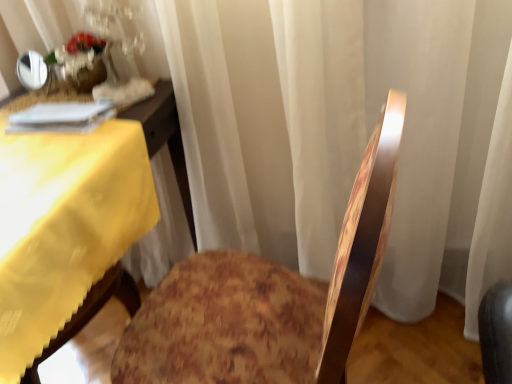
The width and height of the screenshot is (512, 384). Describe the element at coordinates (77, 63) in the screenshot. I see `translucent glass vase at upper left` at that location.

The image size is (512, 384). What do you see at coordinates (165, 137) in the screenshot? I see `yellow fabric table at left` at bounding box center [165, 137].

This screenshot has height=384, width=512. I want to click on yellow fabric table at left, so click(165, 137).

Image resolution: width=512 pixels, height=384 pixels. I want to click on translucent glass vase at upper left, so click(77, 63).

From a real-world perspective, between translucent glass vase at upper left and wooden floral-patterned chair at center, who is vertically higher?

translucent glass vase at upper left.

Between point (64, 78) and point (327, 308), which one is positioned in front?

Point (327, 308)

Looking at this image, from the image's perspective, between translucent glass vase at upper left and wooden floral-patterned chair at center, which one is located above?

From the image's view, translucent glass vase at upper left is above.

Which of these two, translucent glass vase at upper left or wooden floral-patterned chair at center, is wider?

With larger width is wooden floral-patterned chair at center.

Between translucent glass vase at upper left and yellow fabric table at left, which one has more height?

Standing taller between the two is yellow fabric table at left.

Based on the photo, is there a large distance between translucent glass vase at upper left and yellow fabric table at left?

translucent glass vase at upper left is actually quite close to yellow fabric table at left.

From a real-world perspective, which is physically below, translucent glass vase at upper left or yellow fabric table at left?

From a 3D spatial view, yellow fabric table at left is below.

From the image's perspective, which object appears higher, translucent glass vase at upper left or yellow fabric table at left?

From the image's view, translucent glass vase at upper left is above.

Is yellow fabric table at left looking in the opposite direction of wooden floral-patterned chair at center?

No.

Considering the sizes of yellow fabric table at left and wooden floral-patterned chair at center in the image, is yellow fabric table at left taller or shorter than wooden floral-patterned chair at center?

Clearly, yellow fabric table at left is shorter compared to wooden floral-patterned chair at center.

Is yellow fabric table at left located outside wooden floral-patterned chair at center?

Yes, yellow fabric table at left is outside of wooden floral-patterned chair at center.

Locate an element on the screen. rocking chair that appears on the right of yellow fabric table at left is located at coordinates (269, 298).

This screenshot has width=512, height=384. I want to click on rocking chair lying below the translucent glass vase at upper left (from the image's perspective), so click(269, 298).

Can you confirm if wooden floral-patterned chair at center is thinner than translucent glass vase at upper left?

In fact, wooden floral-patterned chair at center might be wider than translucent glass vase at upper left.

Does wooden floral-patterned chair at center have a lesser height compared to translucent glass vase at upper left?

No.

Is the depth of wooden floral-patterned chair at center greater than that of translucent glass vase at upper left?

No, wooden floral-patterned chair at center is closer to the viewer.

Is yellow fabric table at left oriented towards translucent glass vase at upper left?

No, yellow fabric table at left is not turned towards translucent glass vase at upper left.

Consider the image. Is yellow fabric table at left wider or thinner than translucent glass vase at upper left?

Considering their sizes, yellow fabric table at left looks broader than translucent glass vase at upper left.

Is point (148, 150) positioned in front of point (65, 62)?

No, it is behind (65, 62).

Based on their sizes in the image, would you say yellow fabric table at left is bigger or smaller than translucent glass vase at upper left?

Considering their sizes, yellow fabric table at left takes up more space than translucent glass vase at upper left.

Considering the points (312, 286) and (166, 97), which point is behind, point (312, 286) or point (166, 97)?

The point (166, 97) is farther.

From the image's perspective, which one is positioned lower, wooden floral-patterned chair at center or yellow fabric table at left?

wooden floral-patterned chair at center is shown below in the image.

Is wooden floral-patterned chair at center touching yellow fabric table at left?

No, wooden floral-patterned chair at center is not in contact with yellow fabric table at left.

The width and height of the screenshot is (512, 384). I want to click on floral arrangement positioned vertically above the wooden floral-patterned chair at center (from a real-world perspective), so click(77, 63).

Locate an element on the screen. Image resolution: width=512 pixels, height=384 pixels. table on the left of translucent glass vase at upper left is located at coordinates (165, 137).

Estimate the real-world distances between objects in this image. Which object is closer to wooden floral-patterned chair at center, translucent glass vase at upper left or yellow fabric table at left?

yellow fabric table at left is positioned closer to the anchor wooden floral-patterned chair at center.

Considering their positions, is yellow fabric table at left positioned closer to translucent glass vase at upper left than wooden floral-patterned chair at center?

Based on the image, yellow fabric table at left appears to be nearer to translucent glass vase at upper left.

Estimate the real-world distances between objects in this image. Which object is further from yellow fabric table at left, translucent glass vase at upper left or wooden floral-patterned chair at center?

Among the two, wooden floral-patterned chair at center is located further to yellow fabric table at left.

From the image, which object appears to be nearer to wooden floral-patterned chair at center, yellow fabric table at left or translucent glass vase at upper left?

Based on the image, yellow fabric table at left appears to be nearer to wooden floral-patterned chair at center.

Estimate the real-world distances between objects in this image. Which object is further from translucent glass vase at upper left, wooden floral-patterned chair at center or yellow fabric table at left?

The object further to translucent glass vase at upper left is wooden floral-patterned chair at center.

Considering their positions, is wooden floral-patterned chair at center positioned closer to yellow fabric table at left than translucent glass vase at upper left?

translucent glass vase at upper left lies closer to yellow fabric table at left than the other object.

Where is `table between wooden floral-patterned chair at center and translucent glass vase at upper left in the front-back direction`? Image resolution: width=512 pixels, height=384 pixels. table between wooden floral-patterned chair at center and translucent glass vase at upper left in the front-back direction is located at coordinates (165, 137).